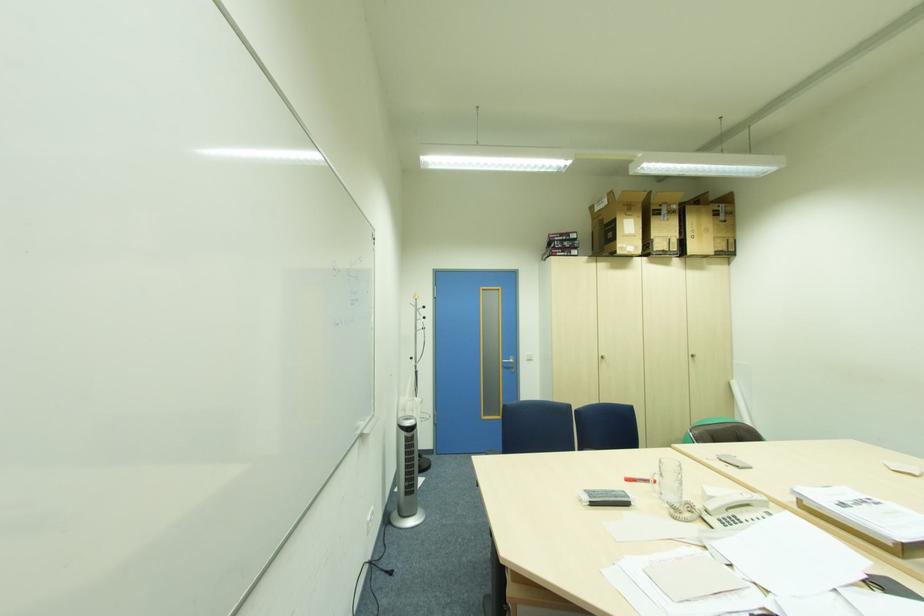
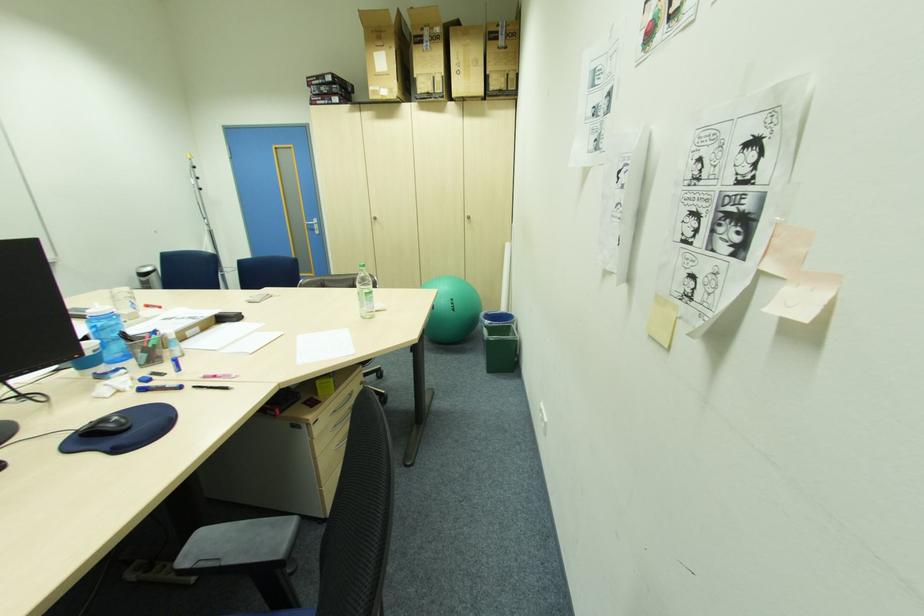
Question: What movement of the cameraman would produce the second image?

Choices:
 (A) Left
 (B) Right
 (C) Forward
 (D) Backward

Answer: (B)